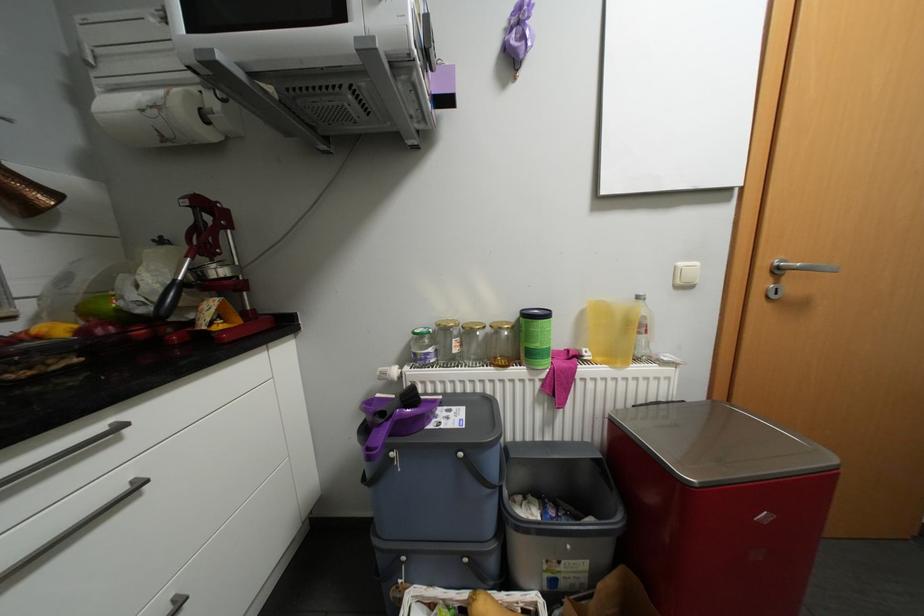
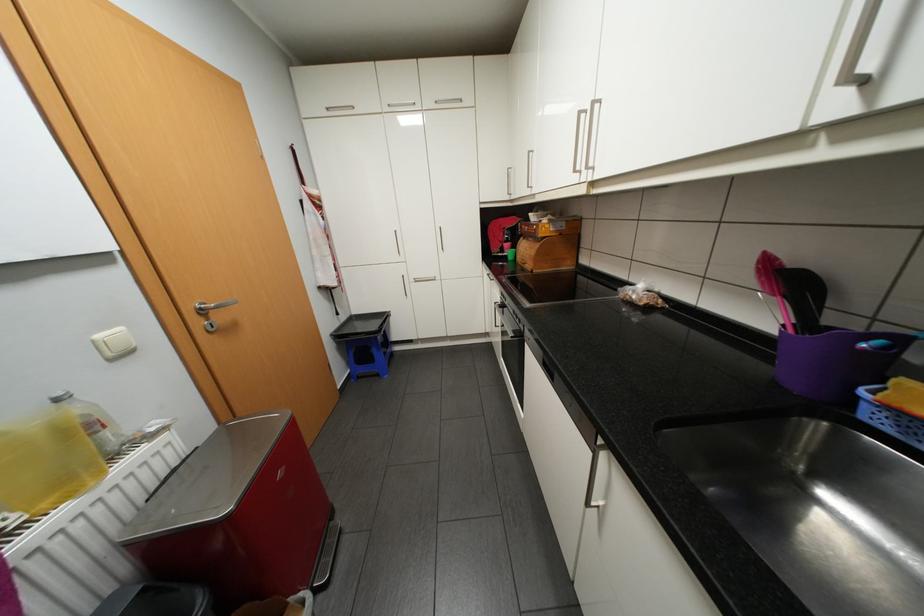
Find the pixel in the second image that matches pixel 688 262 in the first image.

(106, 334)